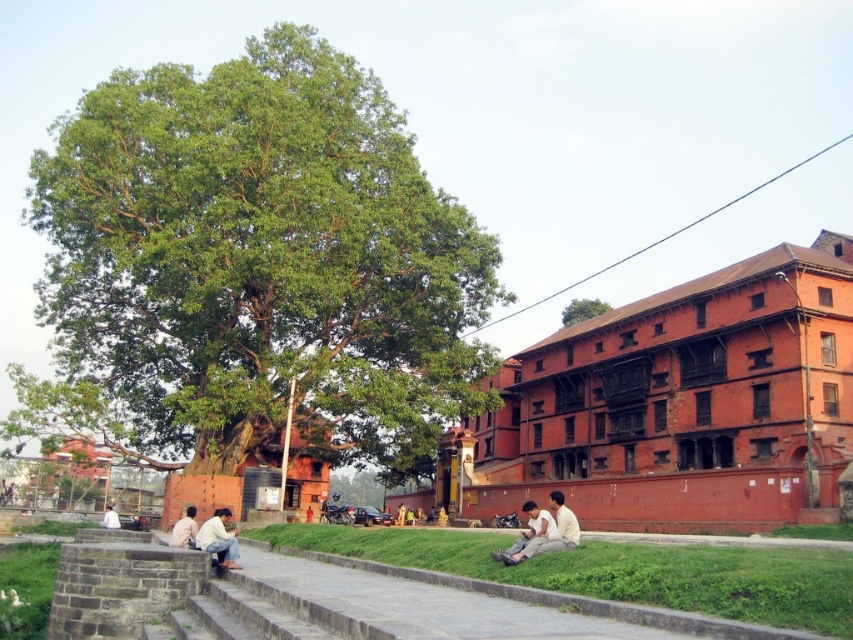
You are standing at the base of the large green tree on the left and want to walk towards the building on the right. There are two points marked in the scene. Which point, point (523, 544) or point (213, 528), would you reach first as you walk towards the building?

You would reach point (523, 544) first because it is closer to the viewer than point (213, 528), so it is nearer along the path towards the building.

You are a visitor walking along the paved pathway towards the large green tree on the left. You want to sit down on the grass. Which grass area, the green grass at lower center or the green grass at lower left, is closer to your current position?

The green grass at lower left is closer to your current position because it is located below the green grass at lower center, meaning it is situated lower in the scene and thus nearer to the pathway where you are walking.